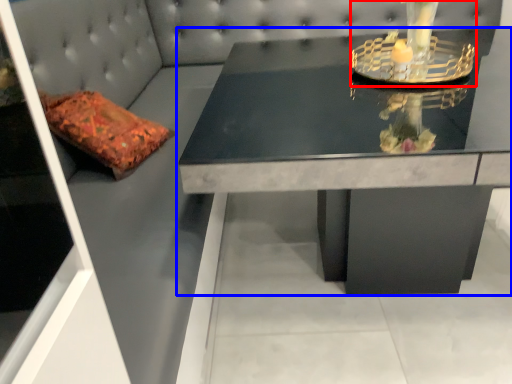
Question: Which of the following is the closest to the observer, candle holder (highlighted by a red box) or table (highlighted by a blue box)?

Choices:
 (A) candle holder
 (B) table

Answer: (B)